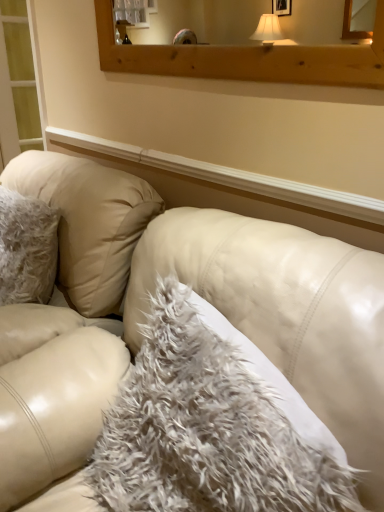
What do you see at coordinates (285, 312) in the screenshot? Image resolution: width=384 pixels, height=512 pixels. I see `white leather couch at center` at bounding box center [285, 312].

The image size is (384, 512). I want to click on white leather couch at center, so click(x=285, y=312).

What do you see at coordinates (20, 81) in the screenshot? I see `translucent glass screen door at left` at bounding box center [20, 81].

Image resolution: width=384 pixels, height=512 pixels. Identify the location of white fluffy pillow at center. (205, 430).

The width and height of the screenshot is (384, 512). Describe the element at coordinates (205, 430) in the screenshot. I see `white fluffy pillow at center` at that location.

Identify the location of white leather couch at center. The image size is (384, 512). (285, 312).

In terms of size, does translucent glass screen door at left appear bigger or smaller than white leather couch at center?

Clearly, translucent glass screen door at left is smaller in size than white leather couch at center.

Is white leather couch at center inside translucent glass screen door at left?

No.

Is point (11, 37) closer to camera compared to point (339, 282)?

No, (11, 37) is further to viewer.

Does point (264, 439) lie behind point (276, 50)?

No, (264, 439) is closer to viewer.

From the image's perspective, is white fluffy pillow at center on wooden frame at upper center?

No, from the image's perspective, white fluffy pillow at center is not above wooden frame at upper center.

Is white leather couch at center taller or shorter than wooden frame at upper center?

Considering their sizes, white leather couch at center has more height than wooden frame at upper center.

Consider the image. Is the depth of white leather couch at center greater than that of wooden frame at upper center?

No.

Does white leather couch at center have a larger size compared to wooden frame at upper center?

Indeed, white leather couch at center has a larger size compared to wooden frame at upper center.

Is white leather couch at center positioned beyond the bounds of wooden frame at upper center?

That's correct, white leather couch at center is outside of wooden frame at upper center.

Which of these two, translucent glass screen door at left or white fluffy pillow at center, is wider?

Wider between the two is white fluffy pillow at center.

Could you tell me if translucent glass screen door at left is turned towards white fluffy pillow at center?

No.

You are a GUI agent. You are given a task and a screenshot of the screen. Output one action in this format:
    pyautogui.click(x=<x>, y=<y>)
    Task: Click on the screen door above the white fluffy pillow at center (from a real-world perspective)
    
    Given the screenshot: What is the action you would take?
    pyautogui.click(x=20, y=81)

From a real-world perspective, between translucent glass screen door at left and white fluffy pillow at center, who is vertically higher?

translucent glass screen door at left, from a real-world perspective.

Considering the relative sizes of wooden frame at upper center and translucent glass screen door at left in the image provided, is wooden frame at upper center smaller than translucent glass screen door at left?

Correct, wooden frame at upper center occupies less space than translucent glass screen door at left.

Is wooden frame at upper center far from translucent glass screen door at left?

wooden frame at upper center is far away from translucent glass screen door at left.

You are a GUI agent. You are given a task and a screenshot of the screen. Output one action in this format:
    pyautogui.click(x=<x>, y=<y>)
    Task: Click on the screen door above the wooden frame at upper center (from the image's perspective)
    The height and width of the screenshot is (512, 384).
    Given the screenshot: What is the action you would take?
    pyautogui.click(x=20, y=81)

From the image's perspective, is wooden frame at upper center located above or below translucent glass screen door at left?

From the image's perspective, wooden frame at upper center appears below translucent glass screen door at left.

Is white fluffy pillow at center touching translucent glass screen door at left?

white fluffy pillow at center and translucent glass screen door at left are clearly separated.

Is white fluffy pillow at center shorter than translucent glass screen door at left?

Yes.

Which is more to the right, white fluffy pillow at center or translucent glass screen door at left?

From the viewer's perspective, white fluffy pillow at center appears more on the right side.

Which is less distant, (274,451) or (29,133)?

Point (274,451) appears to be closer to the viewer than point (29,133).

Does white fluffy pillow at center appear on the right side of white leather couch at center?

Correct, you'll find white fluffy pillow at center to the right of white leather couch at center.

Based on the photo, which is farther from the camera, (253, 448) or (369, 388)?

The point (369, 388) is farther.

In the image, is white fluffy pillow at center positioned in front of or behind white leather couch at center?

white fluffy pillow at center is behind white leather couch at center.

Would you say white fluffy pillow at center is outside white leather couch at center?

No, most part of white fluffy pillow at center lies within white leather couch at center.

Find the location of a particular element. The image size is (384, 512). studio couch below the translucent glass screen door at left (from the image's perspective) is located at coordinates (285, 312).

This screenshot has width=384, height=512. I want to click on window frame on the right side of white fluffy pillow at center, so click(x=247, y=59).

Consider the image. Which object lies nearer to the anchor point white leather couch at center, white fluffy pillow at center or wooden frame at upper center?

white fluffy pillow at center is closer to white leather couch at center.

Looking at the image, which one is located closer to translucent glass screen door at left, white leather couch at center or wooden frame at upper center?

Based on the image, wooden frame at upper center appears to be nearer to translucent glass screen door at left.

Which object lies further to the anchor point white leather couch at center, wooden frame at upper center or translucent glass screen door at left?

translucent glass screen door at left is further to white leather couch at center.

Looking at the image, which one is located closer to wooden frame at upper center, translucent glass screen door at left or white leather couch at center?

white leather couch at center lies closer to wooden frame at upper center than the other object.

Estimate the real-world distances between objects in this image. Which object is closer to translucent glass screen door at left, white fluffy pillow at center or wooden frame at upper center?

Based on the image, wooden frame at upper center appears to be nearer to translucent glass screen door at left.

Based on their spatial positions, is white fluffy pillow at center or translucent glass screen door at left closer to wooden frame at upper center?

white fluffy pillow at center is closer to wooden frame at upper center.

Which object lies further to the anchor point white fluffy pillow at center, white leather couch at center or translucent glass screen door at left?

translucent glass screen door at left lies further to white fluffy pillow at center than the other object.

From the image, which object appears to be nearer to white leather couch at center, wooden frame at upper center or white fluffy pillow at center?

Among the two, white fluffy pillow at center is located nearer to white leather couch at center.

You are a GUI agent. You are given a task and a screenshot of the screen. Output one action in this format:
    pyautogui.click(x=<x>, y=<y>)
    Task: Click on the blanket positioned between white leather couch at center and translucent glass screen door at left from near to far
    
    Given the screenshot: What is the action you would take?
    pyautogui.click(x=205, y=430)

Where is `blanket between wooden frame at upper center and white leather couch at center in the vertical direction`? Image resolution: width=384 pixels, height=512 pixels. blanket between wooden frame at upper center and white leather couch at center in the vertical direction is located at coordinates (205, 430).

You are a GUI agent. You are given a task and a screenshot of the screen. Output one action in this format:
    pyautogui.click(x=<x>, y=<y>)
    Task: Click on the window frame between white fluffy pillow at center and translucent glass screen door at left from front to back
    The height and width of the screenshot is (512, 384).
    Given the screenshot: What is the action you would take?
    pyautogui.click(x=247, y=59)

Locate an element on the screen. window frame between white leather couch at center and translucent glass screen door at left along the z-axis is located at coordinates point(247,59).